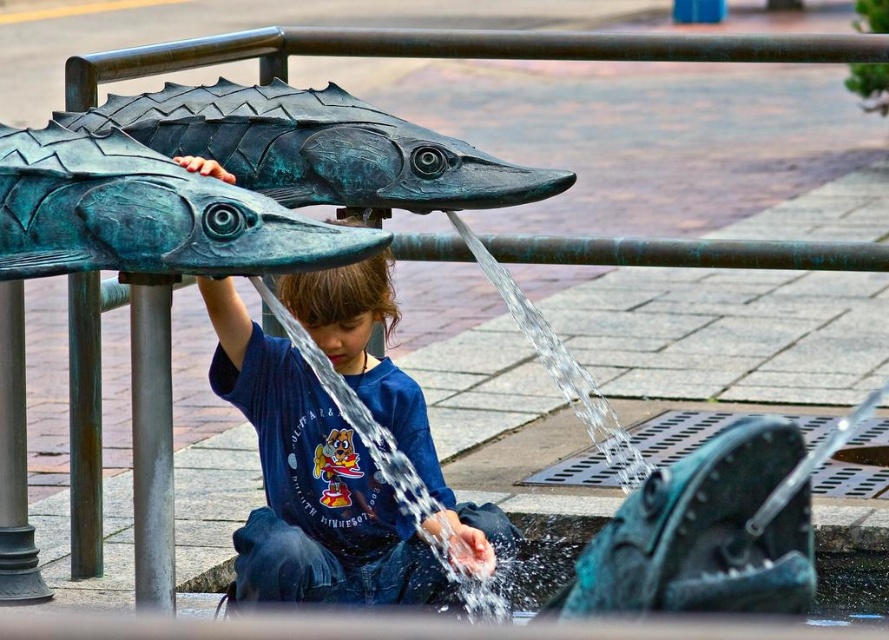
Question: Is matte blue shirt at center to the right of green patina bronze fish at upper left from the viewer's perspective?

Choices:
 (A) yes
 (B) no

Answer: (A)

Question: Which point is closer to the camera taking this photo?

Choices:
 (A) (273, 417)
 (B) (77, 188)

Answer: (B)

Question: Is matte blue shirt at center to the left of green patina bronze fish at upper left from the viewer's perspective?

Choices:
 (A) yes
 (B) no

Answer: (B)

Question: Which of the following is the closest to the observer?

Choices:
 (A) (187, 257)
 (B) (259, 513)

Answer: (A)

Question: Where is matte blue shirt at center located in relation to green patina bronze fish at upper left in the image?

Choices:
 (A) right
 (B) left

Answer: (A)